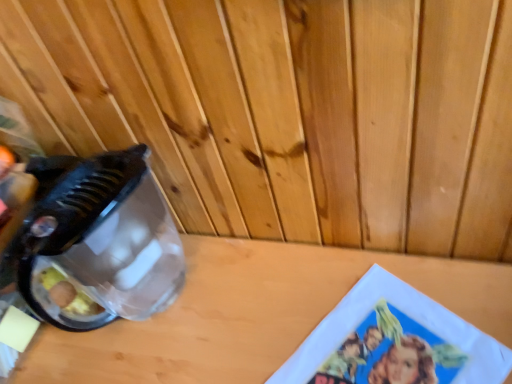
Locate an element on the screen. This screenshot has width=512, height=384. free spot in front of transparent plastic blender at left is located at coordinates (196, 357).